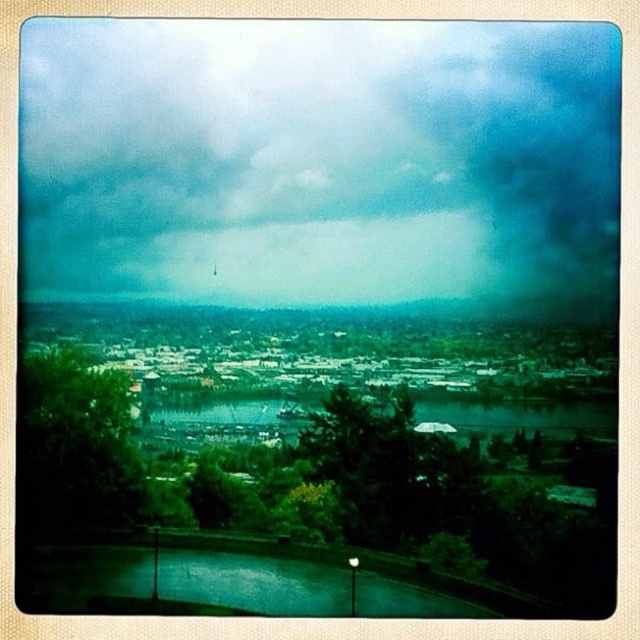
Between green glass lake at lower center and greenish-blue water at center, which one appears on the left side from the viewer's perspective?

green glass lake at lower center

Is green glass lake at lower center behind greenish-blue water at center?

Yes, green glass lake at lower center is further from the viewer.

The image size is (640, 640). What do you see at coordinates (253, 582) in the screenshot?
I see `green glass lake at lower center` at bounding box center [253, 582].

You are a GUI agent. You are given a task and a screenshot of the screen. Output one action in this format:
    pyautogui.click(x=<x>, y=<y>)
    Task: Click on the green glass lake at lower center
    
    Given the screenshot: What is the action you would take?
    pyautogui.click(x=253, y=582)

Which is above, cloudy sky at upper center or green glass lake at lower center?

cloudy sky at upper center

Is point (288, 227) positioned before point (38, 572)?

Yes, it is in front of point (38, 572).

I want to click on cloudy sky at upper center, so click(x=317, y=160).

Between point (168, 284) and point (164, 426), which one is positioned behind?

The point (164, 426) is behind.

Is cloudy sky at upper center further to the viewer compared to greenish-blue water at center?

No, cloudy sky at upper center is in front of greenish-blue water at center.

Describe the element at coordinates (317, 160) in the screenshot. The width and height of the screenshot is (640, 640). I see `cloudy sky at upper center` at that location.

Find the location of a particular element. The width and height of the screenshot is (640, 640). cloudy sky at upper center is located at coordinates tap(317, 160).